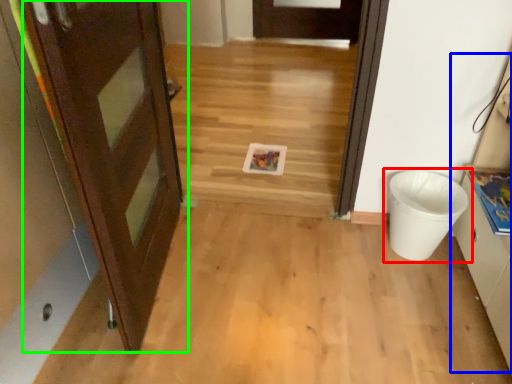
Question: Based on their relative distances, which object is farther from waste container (highlighted by a red box)? Choose from cabinetry (highlighted by a blue box) and door (highlighted by a green box).

Choices:
 (A) cabinetry
 (B) door

Answer: (B)